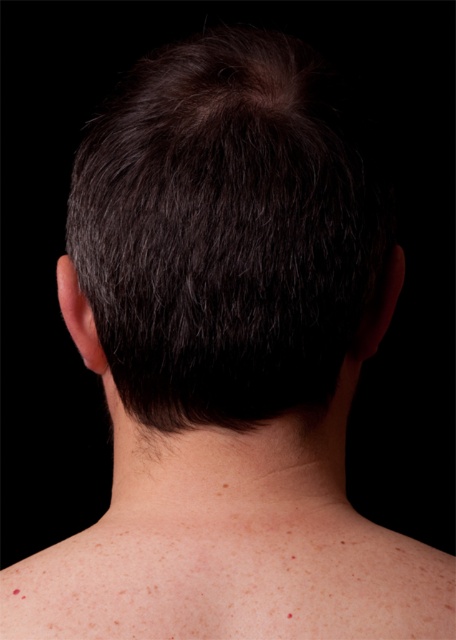
Based on the scene description, which object has a greater height between the dark brown hair at center and the skinsmoothneck at center?

The dark brown hair at center has a greater height compared to the skinsmoothneck at center.

You are a photographer adjusting the focus of your camera. The subject is facing away from you, and you want to ensure that the dark brown hair at center is in sharp focus. If your camera requires the subject to be at least 15 inches away to focus properly, is the current distance sufficient?

The dark brown hair at center and viewer are 16.07 inches apart, which is more than the required 15 inches. Therefore, the current distance is sufficient for the camera to focus properly on the dark brown hair at center.

You are an artist trying to sketch this person. To accurately place the dark brown hair at center, what are the coordinates you should focus on?

The dark brown hair at center is located at coordinates point (227, 234).